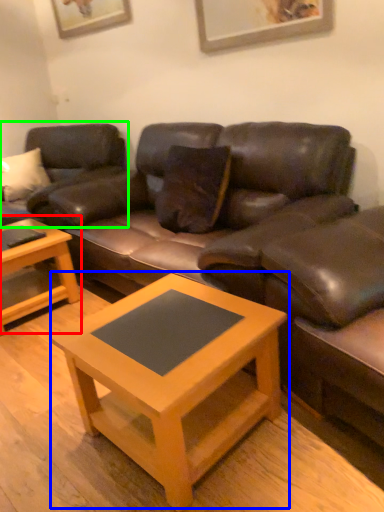
Question: Estimate the real-world distances between objects in this image. Which object is farther from coffee table (highlighted by a red box), coffee table (highlighted by a blue box) or studio couch (highlighted by a green box)?

Choices:
 (A) coffee table
 (B) studio couch

Answer: (A)